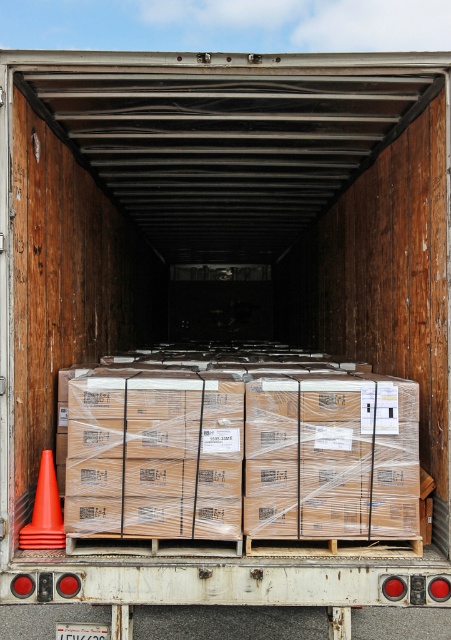
You are a delivery driver who needs to place a new box in the truck. You see the brown cardboard boxes at center and the orange matte traffic cone at lower left. Which object is nearer to you so that you can reach it first without moving your position?

The brown cardboard boxes at center are closer to the viewer than the orange matte traffic cone at lower left, so you can reach them first without moving.

You are a delivery driver who needs to retrieve an item from the brown cardboard boxes at center. However, you notice the orange matte traffic cone at lower left is in your way. Can you easily access the boxes without moving the cone?

The brown cardboard boxes at center is positioned over orange matte traffic cone at lower left, meaning the boxes are stacked above the cone. Since the boxes are above the cone, you can access them without needing to move the cone.